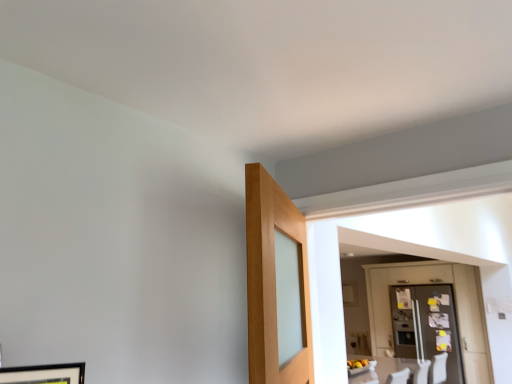
Question: Should I look upward or downward to see matte gray refrigerator at right?

Choices:
 (A) up
 (B) down

Answer: (B)

Question: Should I look upward or downward to see clear glass refrigerator at right?

Choices:
 (A) down
 (B) up

Answer: (A)

Question: From a real-world perspective, does matte gray refrigerator at right sit lower than clear glass refrigerator at right?

Choices:
 (A) yes
 (B) no

Answer: (B)

Question: Is matte gray refrigerator at right wider than clear glass refrigerator at right?

Choices:
 (A) no
 (B) yes

Answer: (A)

Question: Does matte gray refrigerator at right touch clear glass refrigerator at right?

Choices:
 (A) no
 (B) yes

Answer: (A)

Question: From the image's perspective, would you say matte gray refrigerator at right is shown under clear glass refrigerator at right?

Choices:
 (A) yes
 (B) no

Answer: (B)

Question: Does matte gray refrigerator at right have a greater height compared to clear glass refrigerator at right?

Choices:
 (A) no
 (B) yes

Answer: (B)

Question: From a real-world perspective, does matte gray refrigerator at right stand above clear glass refrigerator at right?

Choices:
 (A) no
 (B) yes

Answer: (B)

Question: Can we say clear glass refrigerator at right lies outside matte gray refrigerator at right?

Choices:
 (A) no
 (B) yes

Answer: (A)

Question: Does clear glass refrigerator at right have a greater height compared to matte gray refrigerator at right?

Choices:
 (A) yes
 (B) no

Answer: (B)

Question: Is clear glass refrigerator at right behind matte gray refrigerator at right?

Choices:
 (A) no
 (B) yes

Answer: (B)

Question: Is matte gray refrigerator at right a part of clear glass refrigerator at right?

Choices:
 (A) yes
 (B) no

Answer: (A)

Question: Is clear glass refrigerator at right facing towards matte gray refrigerator at right?

Choices:
 (A) yes
 (B) no

Answer: (A)

Question: Can you confirm if clear glass refrigerator at right is bigger than matte gray refrigerator at right?

Choices:
 (A) yes
 (B) no

Answer: (B)

Question: Visually, is clear glass refrigerator at right positioned to the left or to the right of matte gray refrigerator at right?

Choices:
 (A) right
 (B) left

Answer: (A)